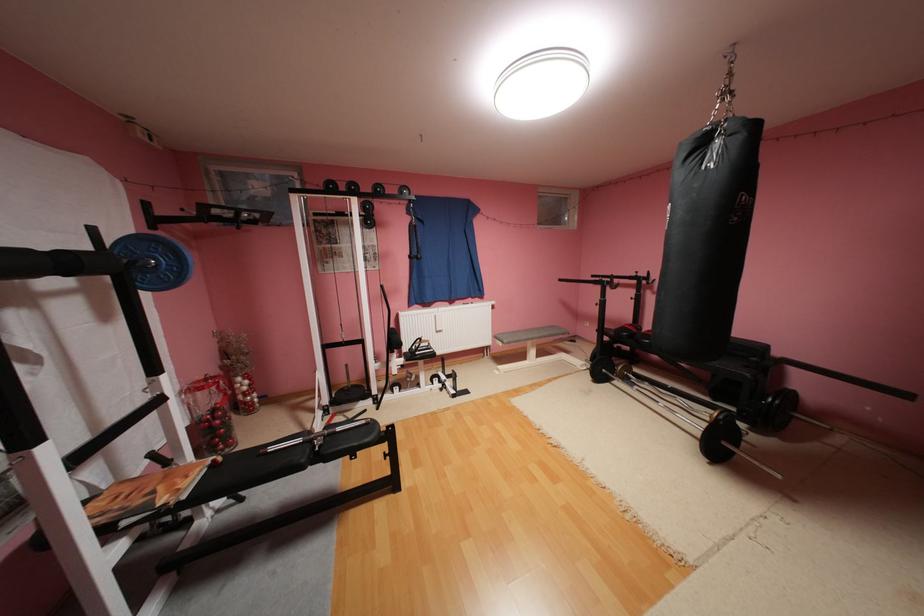
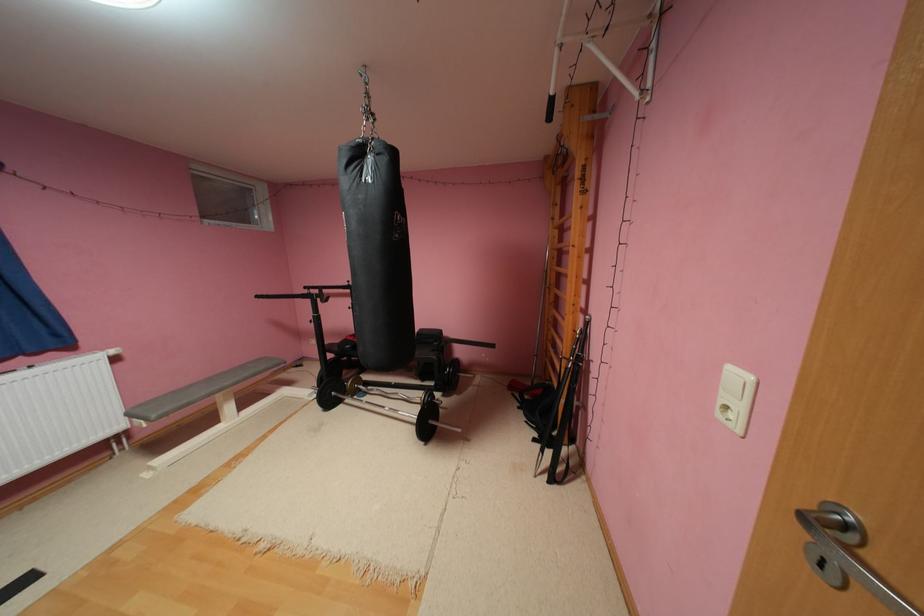
Question: Based on the continuous images, in which direction is the camera rotating? Reply with the corresponding letter.

Choices:
 (A) Left
 (B) Right
 (C) Up
 (D) Down

Answer: (B)